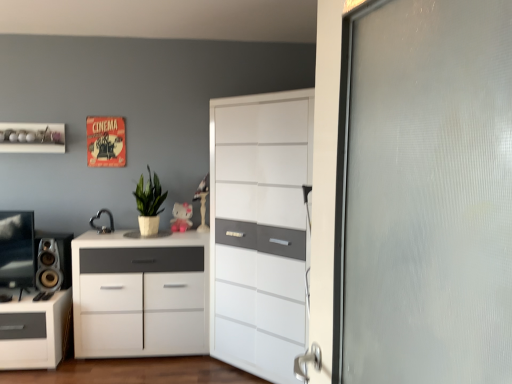
Question: Is the depth of white glossy shelf at upper left greater than that of matte black speaker at left?

Choices:
 (A) no
 (B) yes

Answer: (A)

Question: Would you consider white glossy shelf at upper left to be distant from matte black speaker at left?

Choices:
 (A) no
 (B) yes

Answer: (A)

Question: Is white glossy shelf at upper left looking in the opposite direction of matte black speaker at left?

Choices:
 (A) no
 (B) yes

Answer: (A)

Question: From a real-world perspective, is white glossy shelf at upper left under matte black speaker at left?

Choices:
 (A) no
 (B) yes

Answer: (A)

Question: From the image's perspective, is white glossy shelf at upper left beneath matte black speaker at left?

Choices:
 (A) yes
 (B) no

Answer: (B)

Question: Can you confirm if white glossy shelf at upper left is positioned to the left of matte black speaker at left?

Choices:
 (A) yes
 (B) no

Answer: (A)

Question: Is white glossy shelf at upper left inside matte pink plastic toy at center?

Choices:
 (A) yes
 (B) no

Answer: (B)

Question: Does matte pink plastic toy at center have a lesser height compared to white glossy shelf at upper left?

Choices:
 (A) yes
 (B) no

Answer: (B)

Question: Could you tell me if matte pink plastic toy at center is turned towards white glossy shelf at upper left?

Choices:
 (A) no
 (B) yes

Answer: (A)

Question: Is matte pink plastic toy at center smaller than white glossy shelf at upper left?

Choices:
 (A) yes
 (B) no

Answer: (A)

Question: Can you confirm if matte pink plastic toy at center is positioned to the left of white glossy shelf at upper left?

Choices:
 (A) no
 (B) yes

Answer: (A)

Question: From a real-world perspective, is matte pink plastic toy at center physically above white glossy shelf at upper left?

Choices:
 (A) yes
 (B) no

Answer: (B)

Question: Considering the relative positions of matte pink plastic toy at center and white glossy cabinet at center, the second chest of drawers positioned from the left, in the image provided, is matte pink plastic toy at center behind white glossy cabinet at center, the second chest of drawers positioned from the left,?

Choices:
 (A) yes
 (B) no

Answer: (A)